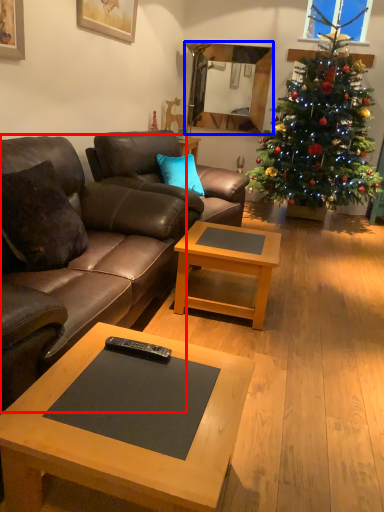
Question: Among these objects, which one is farthest to the camera, studio couch (highlighted by a red box) or mirror (highlighted by a blue box)?

Choices:
 (A) studio couch
 (B) mirror

Answer: (B)